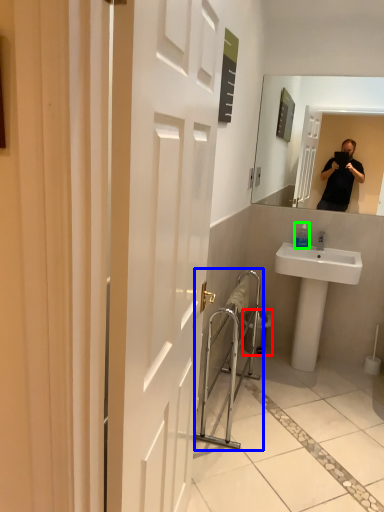
Question: Which object is positioned farthest from trash bin/can (highlighted by a red box)? Select from balustrade (highlighted by a blue box) and bottle (highlighted by a green box).

Choices:
 (A) balustrade
 (B) bottle

Answer: (B)